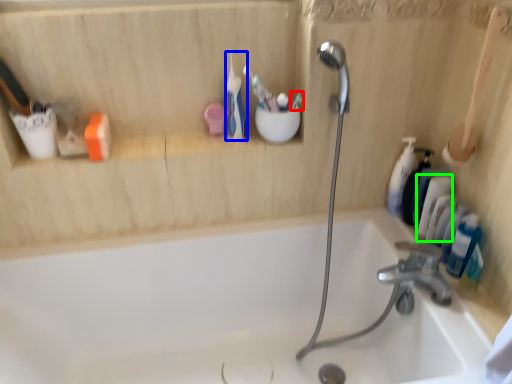
Question: Which object is the closest to the toothbrush (highlighted by a red box)? Choose among these: toothbrush (highlighted by a blue box) or toiletry (highlighted by a green box).

Choices:
 (A) toothbrush
 (B) toiletry

Answer: (A)